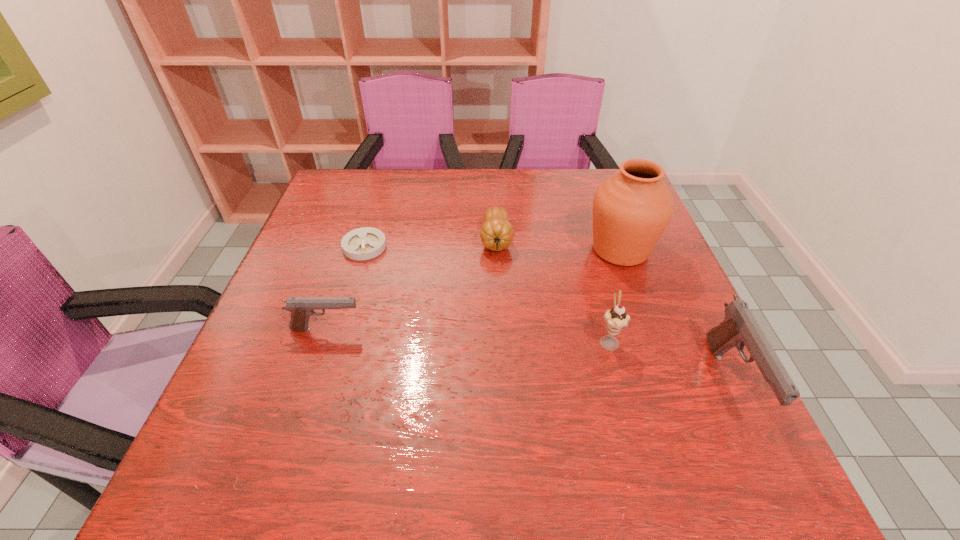
At what (x,y) coordinates should I click in order to perform the action: click on vacant space located on the left of the urn. Please return your answer as a coordinate pair (x, y). This screenshot has height=540, width=960. Looking at the image, I should click on (538, 250).

You are a GUI agent. You are given a task and a screenshot of the screen. Output one action in this format:
    pyautogui.click(x=<x>, y=<y>)
    Task: Click on the free region located on the stem side of the gourd
    
    Given the screenshot: What is the action you would take?
    pyautogui.click(x=500, y=323)

Where is `free region located on the left of the icecream`? Image resolution: width=960 pixels, height=540 pixels. free region located on the left of the icecream is located at coordinates (503, 340).

You are a GUI agent. You are given a task and a screenshot of the screen. Output one action in this format:
    pyautogui.click(x=<x>, y=<y>)
    Task: Click on the object at the near edge
    This screenshot has width=960, height=540.
    Given the screenshot: What is the action you would take?
    pyautogui.click(x=739, y=328)

Identify the location of pistol present at the left edge. The height and width of the screenshot is (540, 960). (301, 308).

Locate an element on the screen. This screenshot has height=540, width=960. ashtray present at the left edge is located at coordinates (364, 243).

Where is `pistol present at the right edge`? pistol present at the right edge is located at coordinates (739, 328).

You are a GUI agent. You are given a task and a screenshot of the screen. Output one action in this format:
    pyautogui.click(x=<x>, y=<y>)
    Task: Click on the urn located at the right edge
    This screenshot has width=960, height=540.
    Given the screenshot: What is the action you would take?
    pyautogui.click(x=631, y=209)

Find the location of a particular element. The height and width of the screenshot is (540, 960). object located in the near right corner section of the desktop is located at coordinates (739, 328).

You are a GUI agent. You are given a task and a screenshot of the screen. Output one action in this format:
    pyautogui.click(x=<x>, y=<y>)
    Task: Click on the free space at the far edge
    
    Given the screenshot: What is the action you would take?
    pyautogui.click(x=493, y=169)